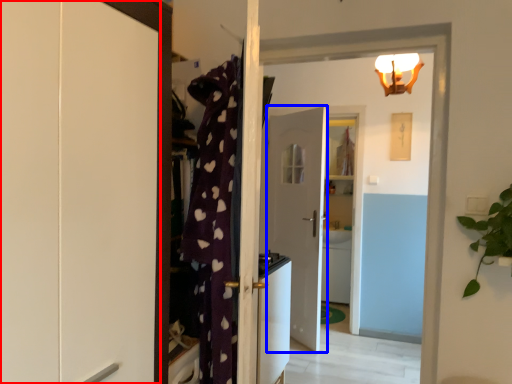
Question: Among these objects, which one is farthest to the camera, cabinetry (highlighted by a red box) or door (highlighted by a blue box)?

Choices:
 (A) cabinetry
 (B) door

Answer: (B)